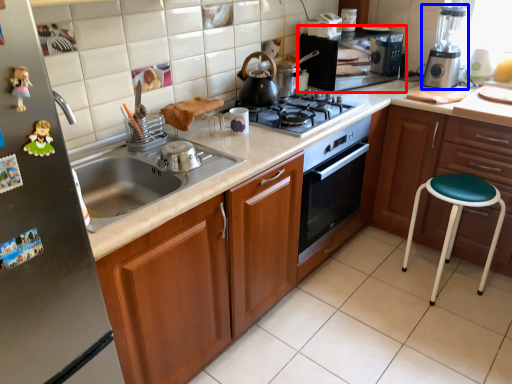
Question: Which point is further to the camera, home appliance (highlighted by a red box) or kitchen appliance (highlighted by a blue box)?

Choices:
 (A) home appliance
 (B) kitchen appliance

Answer: (A)